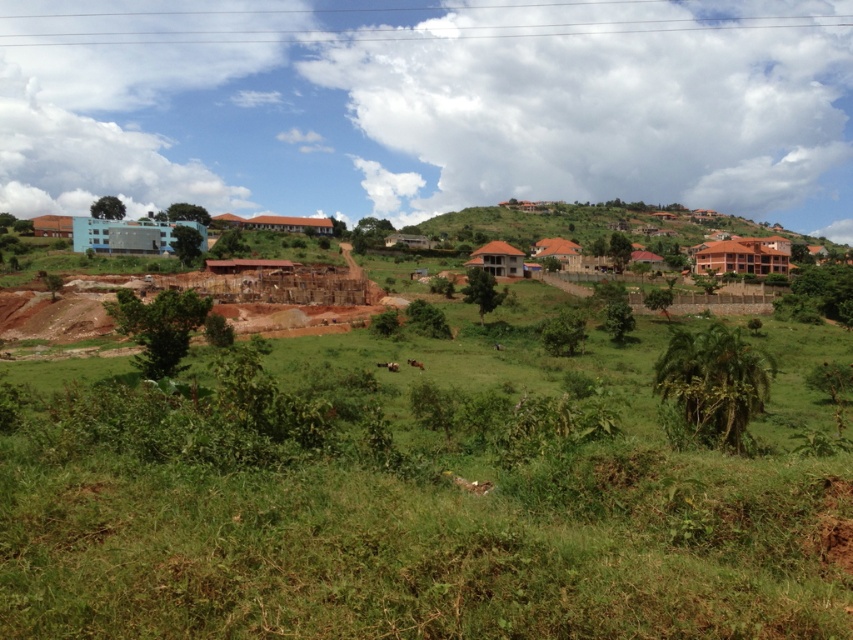
You are a delivery drone that needs to land in the area shown. You must choose between landing on the roof of the blue glass building at upper left or the brown matte building at right. Which building should you choose to ensure you have enough space for a safe landing?

The brown matte building at right is larger and occupies more space than the blue glass building at upper left, so you should choose the brown matte building at right for a safe landing.

You are standing at the center of the image and want to locate the blue glass building at upper left and the brown matte building at right. Which building is positioned to the left of the other?

The blue glass building at upper left is positioned to the left of the brown matte building at right.